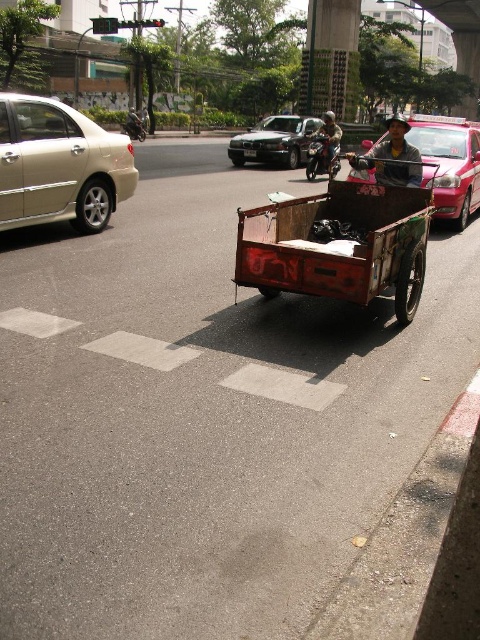
From the picture: You are a pedestrian standing at the edge of the street. You see a shiny black sedan at center and a shiny black motorcycle at center. Which one is nearer to you?

The shiny black sedan at center is closer to the viewer than the shiny black motorcycle at center.

You are a delivery driver who needs to park your matte brown cart at center in a specific spot. The parking area requires vehicles to be positioned at coordinates between 0.2 and 0.8 on both axes. Can your cart fit within these coordinates?

The matte brown cart at center is positioned at point (391, 157). Since both coordinates are within the required range of 0.2 to 0.8, the cart can fit within the parking area.